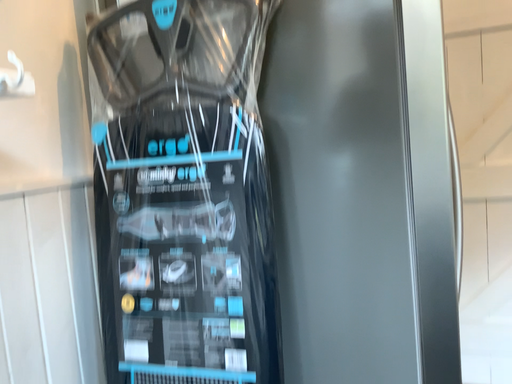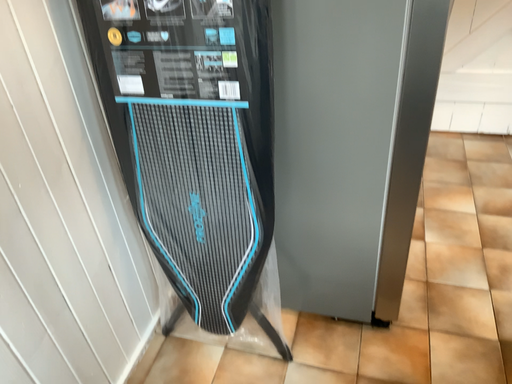
Question: Which way did the camera rotate in the video?

Choices:
 (A) rotated upward
 (B) rotated downward

Answer: (B)